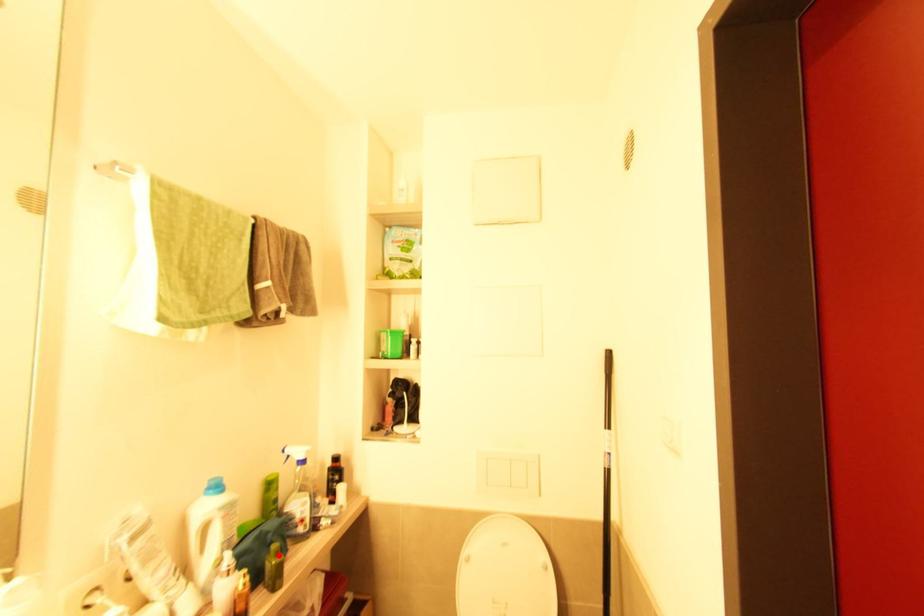
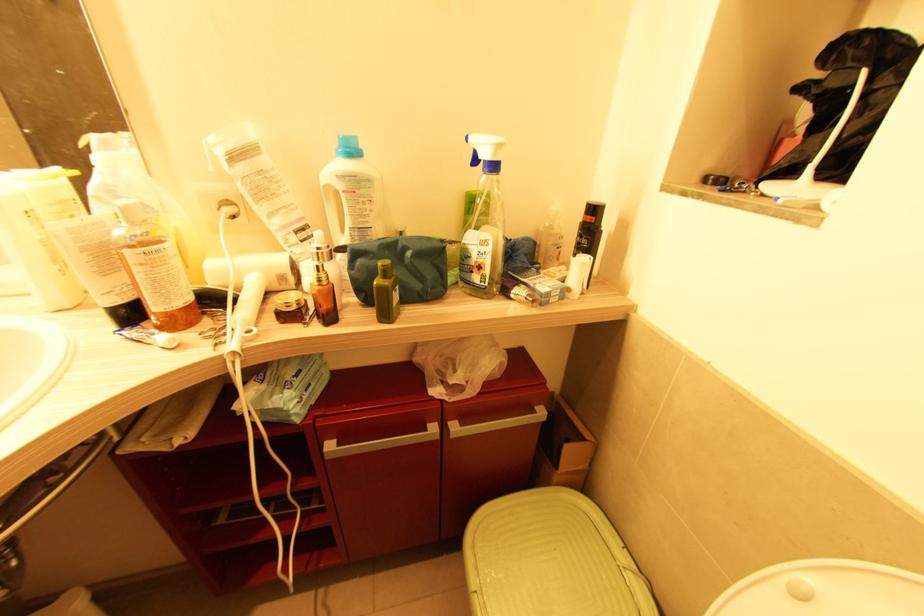
The point at the highlighted location is marked in the first image. Where is the corresponding point in the second image?

(386, 278)